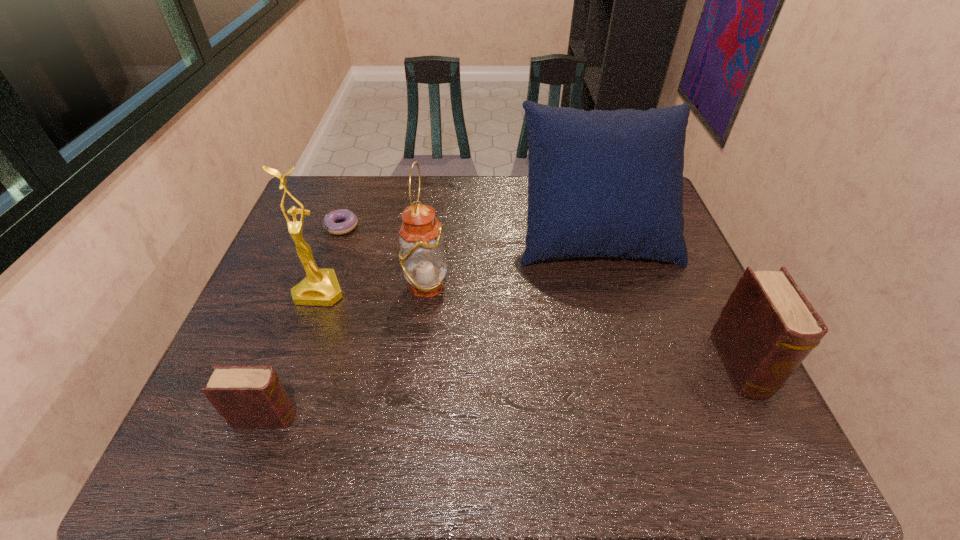
If equal spacing is desired by inserting an extra diary among them, please point out a free spot for this new diary. Please provide its 2D coordinates. Your answer should be formatted as a tuple, i.e. [(x, y)], where the tuple contains the x and y coordinates of a point satisfying the conditions above.

[(515, 390)]